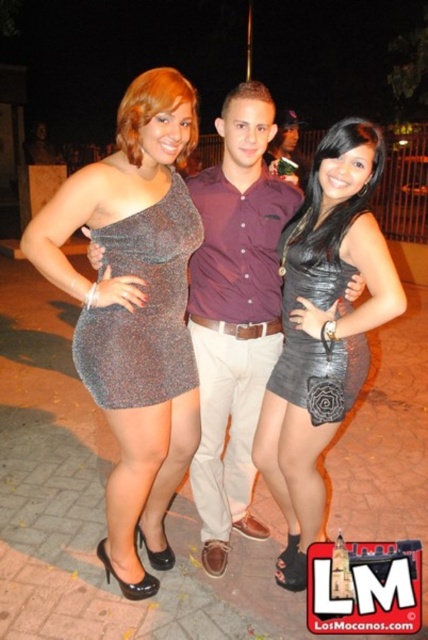
Question: Does leather-like black dress at center appear under black leather dress at center?

Choices:
 (A) yes
 (B) no

Answer: (A)

Question: Which point appears closest to the camera in this image?

Choices:
 (A) (234, 99)
 (B) (175, 211)
 (C) (347, 273)
 (D) (290, 280)

Answer: (C)

Question: Does sparkly metallic dress at center appear on the right side of leather skirt at center?

Choices:
 (A) no
 (B) yes

Answer: (A)

Question: Which of the following is the farthest from the observer?

Choices:
 (A) sparkly metallic dress at left
 (B) sparkly metallic dress at center
 (C) leather skirt at center

Answer: (A)

Question: Which point is farther to the camera?

Choices:
 (A) (180, 241)
 (B) (389, 278)
 (C) (92, 388)

Answer: (C)

Question: Can you confirm if sparkly metallic dress at left is smaller than leather-like black dress at center?

Choices:
 (A) yes
 (B) no

Answer: (B)